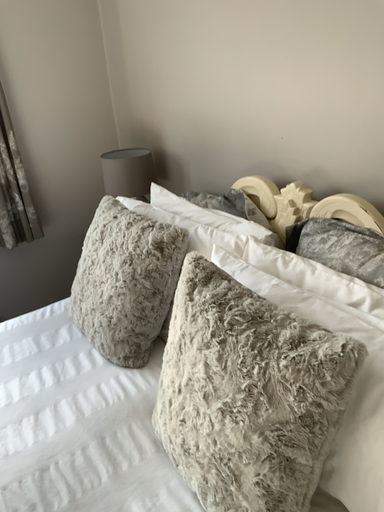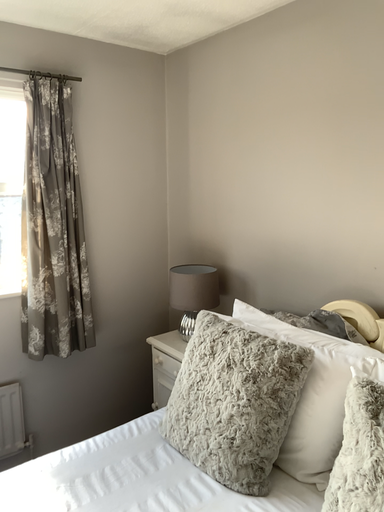
Question: Which way did the camera rotate in the video?

Choices:
 (A) rotated upward
 (B) rotated downward

Answer: (A)